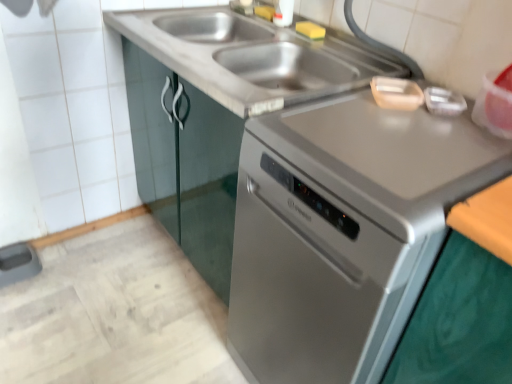
Question: Is stainless steel sink at center taller or shorter than satin silver dishwasher at center?

Choices:
 (A) tall
 (B) short

Answer: (B)

Question: Looking at their shapes, would you say stainless steel sink at center is wider or thinner than satin silver dishwasher at center?

Choices:
 (A) thin
 (B) wide

Answer: (A)

Question: Is stainless steel sink at center inside the boundaries of satin silver dishwasher at center, or outside?

Choices:
 (A) inside
 (B) outside

Answer: (B)

Question: Choose the correct answer: Is satin silver dishwasher at center inside stainless steel sink at center or outside it?

Choices:
 (A) outside
 (B) inside

Answer: (A)

Question: Looking at their shapes, would you say satin silver dishwasher at center is wider or thinner than stainless steel sink at center?

Choices:
 (A) thin
 (B) wide

Answer: (B)

Question: From a real-world perspective, relative to stainless steel sink at center, is satin silver dishwasher at center vertically above or below?

Choices:
 (A) above
 (B) below

Answer: (B)

Question: In terms of size, does satin silver dishwasher at center appear bigger or smaller than stainless steel sink at center?

Choices:
 (A) big
 (B) small

Answer: (A)